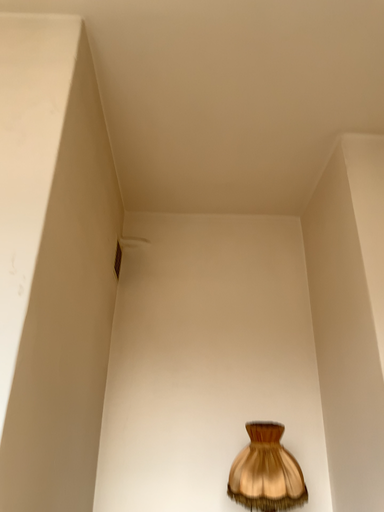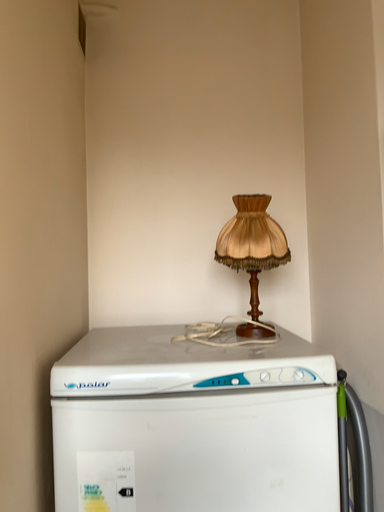
Question: How did the camera likely rotate when shooting the video?

Choices:
 (A) rotated upward
 (B) rotated downward

Answer: (B)